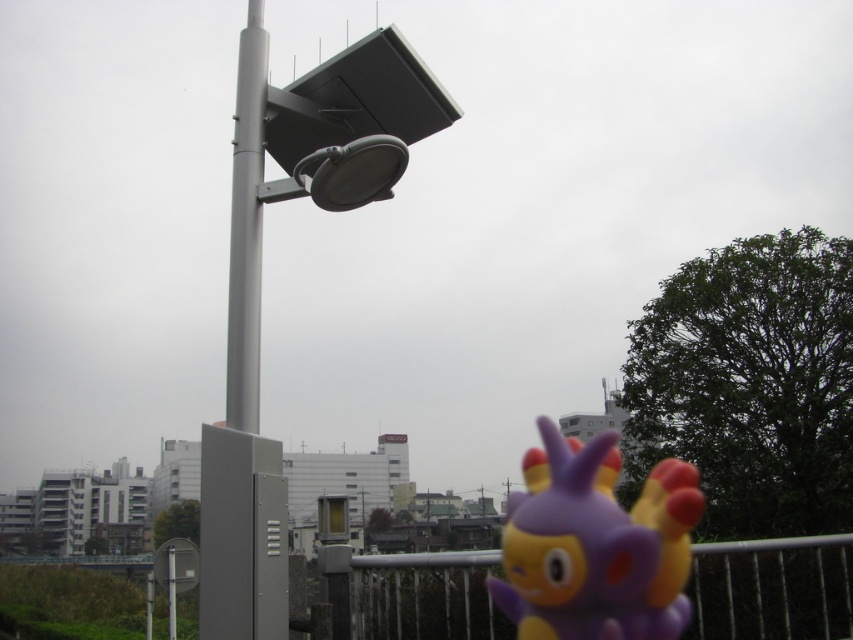
Question: Which object is closer to the camera taking this photo?

Choices:
 (A) gray metallic pole at center
 (B) purple rubber toy at lower right
 (C) white metal fence at lower center

Answer: (A)

Question: In this image, where is purple rubber toy at lower right located relative to gray metallic pole at center?

Choices:
 (A) below
 (B) above

Answer: (A)

Question: Can you confirm if satin silver pole at upper center is positioned above purple rubber toy at lower right?

Choices:
 (A) no
 (B) yes

Answer: (B)

Question: Which is farther from the satin silver pole at upper center?

Choices:
 (A) white metal fence at lower center
 (B) purple rubber toy at lower right

Answer: (B)

Question: Does white metal fence at lower center lie in front of gray metallic pole at center?

Choices:
 (A) no
 (B) yes

Answer: (A)

Question: Which is nearer to the white metal fence at lower center?

Choices:
 (A) purple rubber toy at lower right
 (B) gray metallic pole at center

Answer: (A)